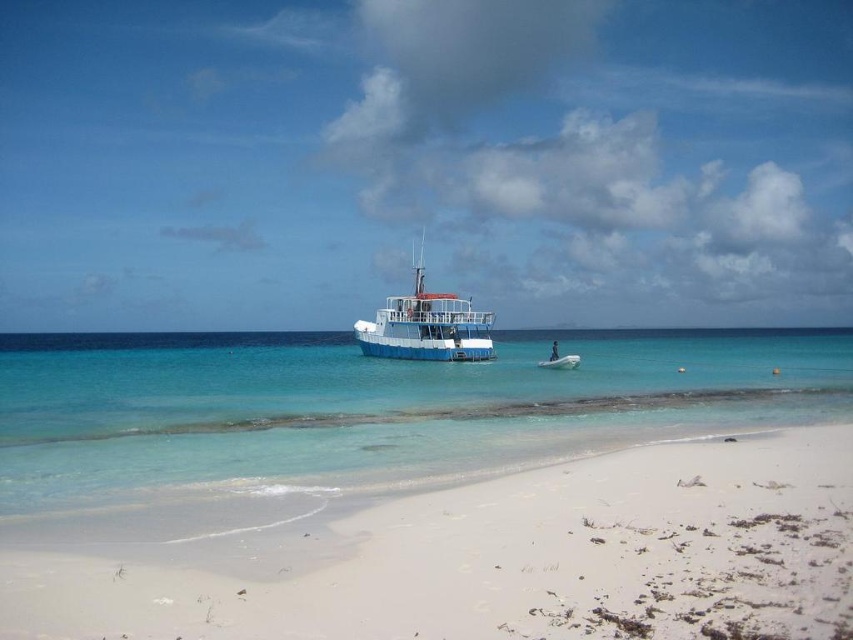
Where is `white sandy beach at lower right`? This screenshot has height=640, width=853. white sandy beach at lower right is located at coordinates (508, 557).

Does point (471, 627) come farther from viewer compared to point (128, 488)?

That is False.

Is point (643, 560) farther from viewer compared to point (329, 368)?

That is False.

The image size is (853, 640). Identify the location of white sandy beach at lower right. (508, 557).

Is point (392, 428) closer to camera compared to point (473, 316)?

Yes, it is in front of point (473, 316).

Between point (119, 374) and point (456, 336), which one is positioned in front?

Positioned in front is point (119, 374).

The width and height of the screenshot is (853, 640). Identify the location of clear blue water at center. (368, 404).

Which is more to the right, white sandy beach at lower right or blue matte boat at center?

white sandy beach at lower right

Does point (564, 544) lie in front of point (386, 305)?

Yes, it is.

Where is `white sandy beach at lower right`? The width and height of the screenshot is (853, 640). white sandy beach at lower right is located at coordinates (508, 557).